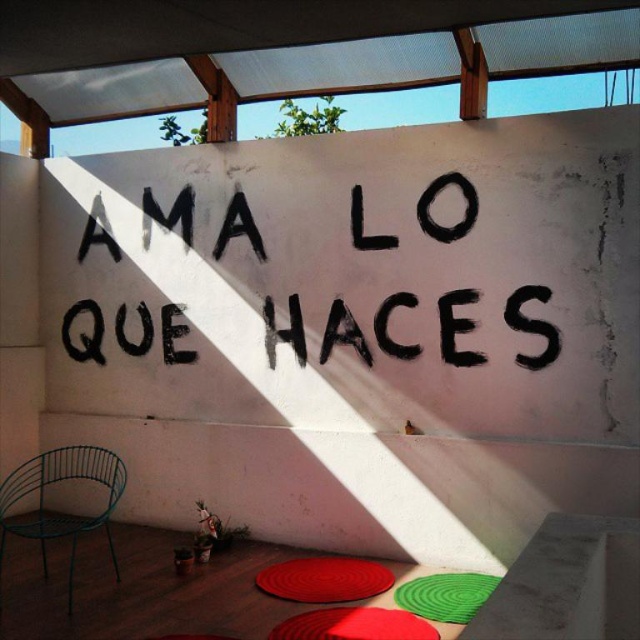
You are a painter standing in the center of the scene and want to paint the black painted text at center and the rubberized red circular mat at lower center. Which object will require you to lift your brush higher to reach its top?

The black painted text at center is much taller as rubberized red circular mat at lower center, so you will need to lift your brush higher to reach the top of the black painted text at center.

You are planning to place a small potted plant between the red rubber mat at lower center and the green spiral mat at center. Which mat should the plant be closer to if you want it to be near the wider mat?

The red rubber mat at lower center is wider than the green spiral mat at center, so the plant should be placed closer to the red rubber mat at lower center.